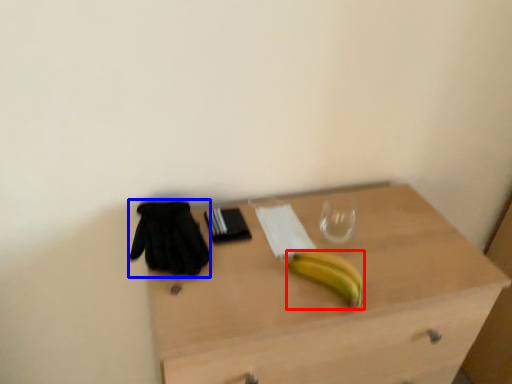
Question: Among these objects, which one is nearest to the camera, banana (highlighted by a red box) or glove (highlighted by a blue box)?

Choices:
 (A) banana
 (B) glove

Answer: (A)